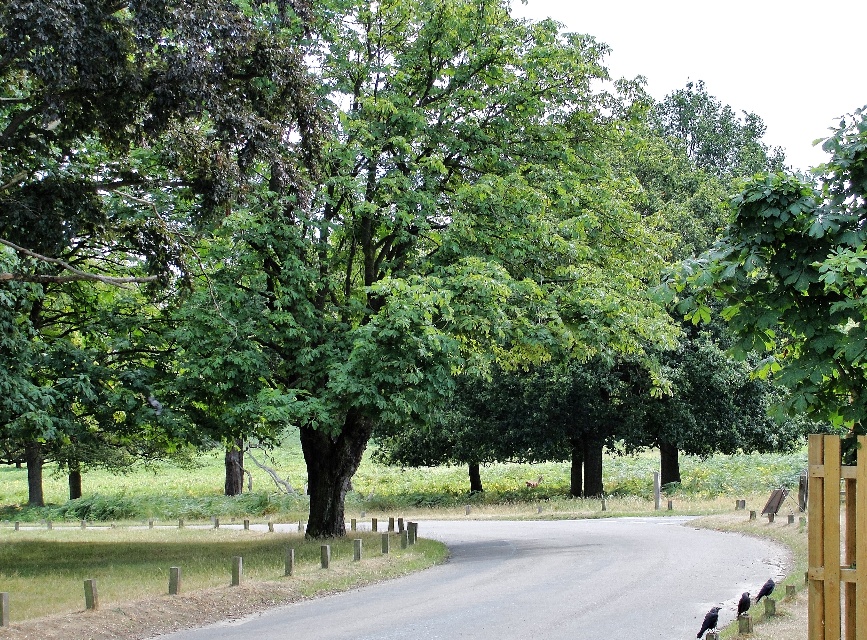
Measure the distance between green leafy tree at upper center and light brown wooden fence at right.

green leafy tree at upper center and light brown wooden fence at right are 15.98 meters apart from each other.

Who is lower down, green leafy tree at upper center or light brown wooden fence at right?

Positioned lower is light brown wooden fence at right.

Locate an element on the screen. This screenshot has width=867, height=640. green leafy tree at upper center is located at coordinates (796, 280).

You are a GUI agent. You are given a task and a screenshot of the screen. Output one action in this format:
    pyautogui.click(x=<x>, y=<y>)
    Task: Click on the green leafy tree at upper center
    This screenshot has height=640, width=867.
    Given the screenshot: What is the action you would take?
    pyautogui.click(x=796, y=280)

The width and height of the screenshot is (867, 640). I want to click on green leafy tree at upper center, so click(796, 280).

Is point (793, 353) positioned after point (80, 577)?

No, (793, 353) is in front of (80, 577).

Locate an element on the screen. Image resolution: width=867 pixels, height=640 pixels. green leafy tree at upper center is located at coordinates (796, 280).

Between green leafy tree at upper center and brown wooden fence at right, which one has less height?

brown wooden fence at right is shorter.

Is green leafy tree at upper center behind brown wooden fence at right?

No, it is in front of brown wooden fence at right.

Between point (745, 323) and point (807, 515), which one is positioned behind?

The point (745, 323) is more distant.

This screenshot has height=640, width=867. Find the location of `green leafy tree at upper center`. green leafy tree at upper center is located at coordinates (796, 280).